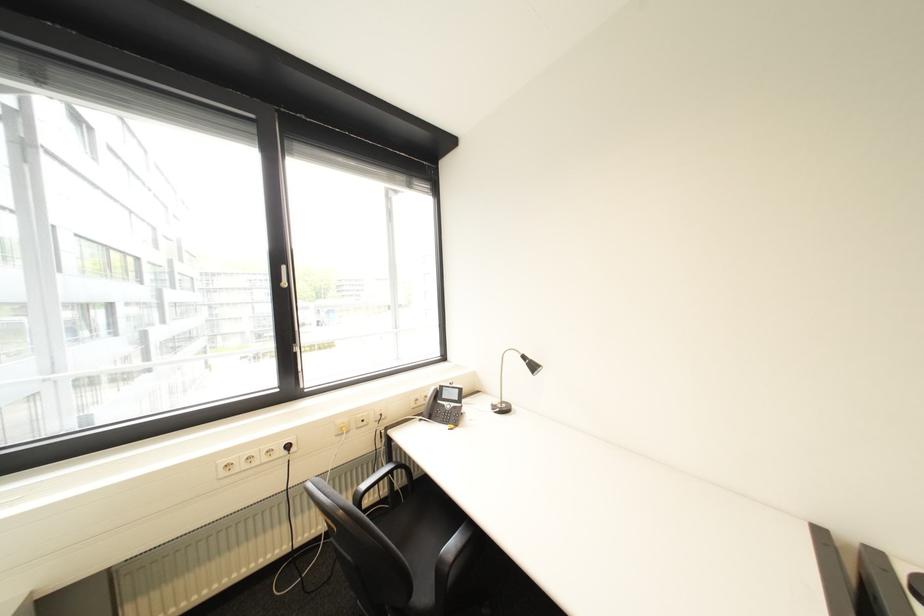
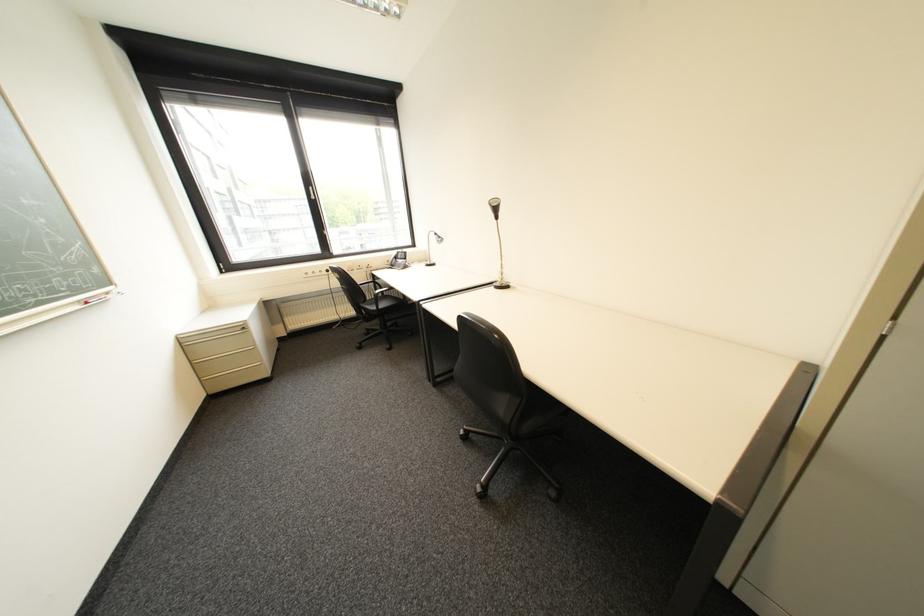
In a continuous first-person perspective shot, in which direction is the camera moving?

The cameraman walked toward right, backward.